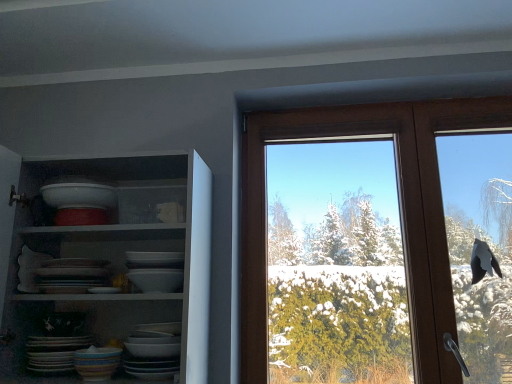
Question: Is matte ceramic platter at lower left closer to the viewer compared to multicolored ceramic bowl at lower left?

Choices:
 (A) no
 (B) yes

Answer: (A)

Question: From a real-world perspective, is matte ceramic platter at lower left physically above multicolored ceramic bowl at lower left?

Choices:
 (A) yes
 (B) no

Answer: (A)

Question: Is matte ceramic platter at lower left behind multicolored ceramic bowl at lower left?

Choices:
 (A) no
 (B) yes

Answer: (B)

Question: Is matte ceramic platter at lower left aimed at multicolored ceramic bowl at lower left?

Choices:
 (A) no
 (B) yes

Answer: (A)

Question: Is matte ceramic platter at lower left in contact with multicolored ceramic bowl at lower left?

Choices:
 (A) no
 (B) yes

Answer: (B)

Question: From the image's perspective, is white glossy shelves at upper left positioned above or below brown wooden window at upper right?

Choices:
 (A) below
 (B) above

Answer: (A)

Question: Does point (131, 215) appear closer or farther from the camera than point (458, 372)?

Choices:
 (A) farther
 (B) closer

Answer: (B)

Question: In terms of size, does white glossy shelves at upper left appear bigger or smaller than brown wooden window at upper right?

Choices:
 (A) small
 (B) big

Answer: (B)

Question: In terms of height, does white glossy shelves at upper left look taller or shorter compared to brown wooden window at upper right?

Choices:
 (A) short
 (B) tall

Answer: (A)

Question: Based on their sizes in the image, would you say multicolored ceramic bowl at lower left is bigger or smaller than matte ceramic platter at lower left?

Choices:
 (A) big
 (B) small

Answer: (B)

Question: In the image, is multicolored ceramic bowl at lower left positioned in front of or behind matte ceramic platter at lower left?

Choices:
 (A) front
 (B) behind

Answer: (A)

Question: From a real-world perspective, relative to matte ceramic platter at lower left, is multicolored ceramic bowl at lower left vertically above or below?

Choices:
 (A) below
 (B) above

Answer: (A)

Question: Is point (98, 377) positioned closer to the camera than point (28, 360)?

Choices:
 (A) closer
 (B) farther

Answer: (A)

Question: From a real-world perspective, relative to white glossy shelves at upper left, is multicolored ceramic bowl at lower left vertically above or below?

Choices:
 (A) above
 (B) below

Answer: (B)

Question: Does point pos(87,380) appear closer or farther from the camera than point pos(10,319)?

Choices:
 (A) farther
 (B) closer

Answer: (B)